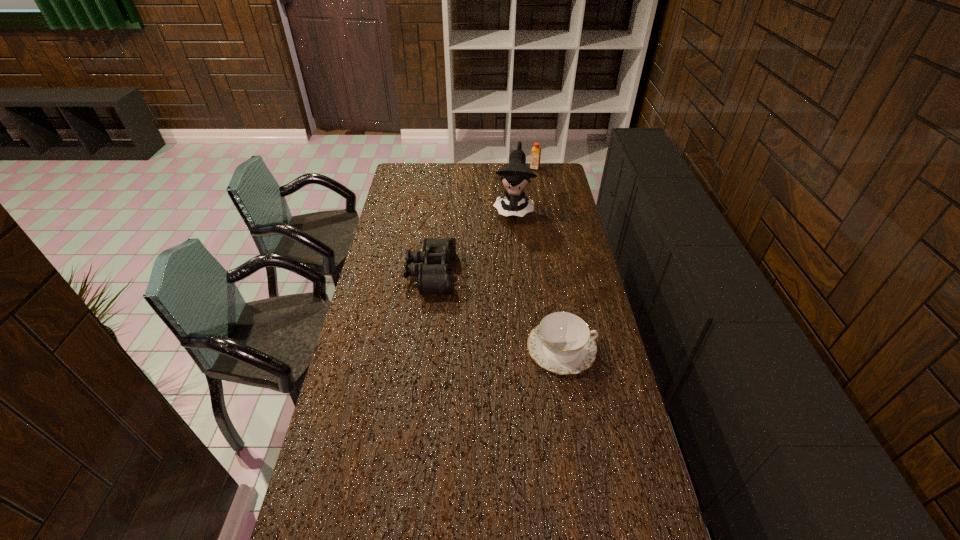
Identify the location of free space located 0.160m at the face of the tallest object. The width and height of the screenshot is (960, 540). (508, 246).

Identify the location of free space located at the face of the tallest object. Image resolution: width=960 pixels, height=540 pixels. (509, 243).

Identify the location of vacant space positioned 0.370m on the front and back of the farthest object. (522, 207).

The width and height of the screenshot is (960, 540). I want to click on vacant region located 0.240m on the front and back of the farthest object, so click(x=526, y=193).

Where is `vacant space located on the front and back of the farthest object`? Image resolution: width=960 pixels, height=540 pixels. vacant space located on the front and back of the farthest object is located at coordinates (525, 198).

At what (x,y) coordinates should I click in order to perform the action: click on object positioned at the far edge. Please return your answer as a coordinate pair (x, y). The width and height of the screenshot is (960, 540). Looking at the image, I should click on (535, 158).

Identify the location of object located at the left edge. tap(434, 276).

At what (x,y) coordinates should I click in order to perform the action: click on chinaware that is at the right edge. Please return your answer as a coordinate pair (x, y). Looking at the image, I should click on (562, 343).

You are a GUI agent. You are given a task and a screenshot of the screen. Output one action in this format:
    pyautogui.click(x=<x>, y=<y>)
    Task: Click on the orange juice located in the right edge section of the desktop
    The image size is (960, 540).
    Given the screenshot: What is the action you would take?
    pyautogui.click(x=535, y=158)

In order to click on object present at the far right corner in this screenshot , I will do pyautogui.click(x=535, y=158).